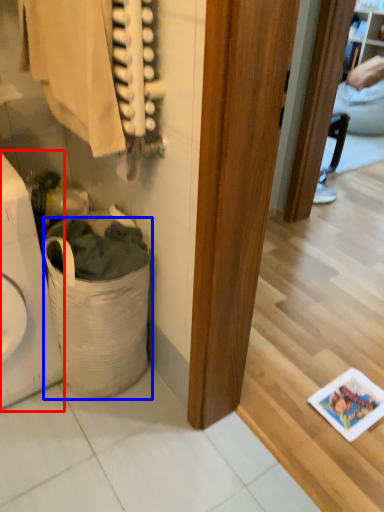
Question: Which object is further to the camera taking this photo, appliance (highlighted by a red box) or laundry basket (highlighted by a blue box)?

Choices:
 (A) appliance
 (B) laundry basket

Answer: (B)